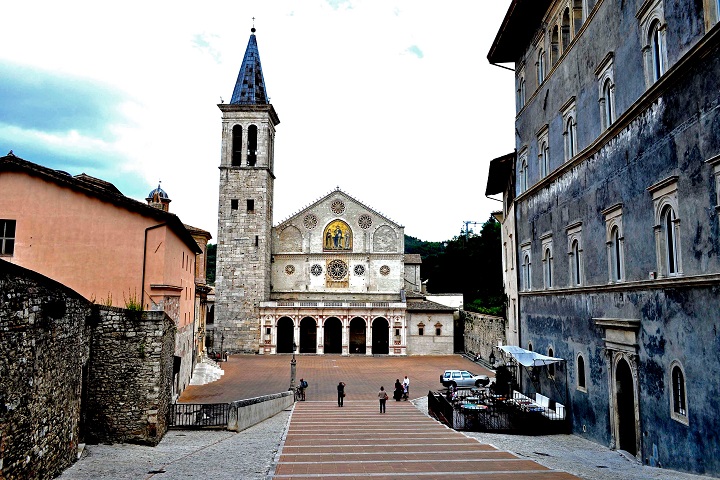
At what (x,y) coordinates should I click in order to perform the action: click on 1 set of stairs. Please return your answer as a coordinate pair (x, y). The width and height of the screenshot is (720, 480). Looking at the image, I should click on (395, 444).